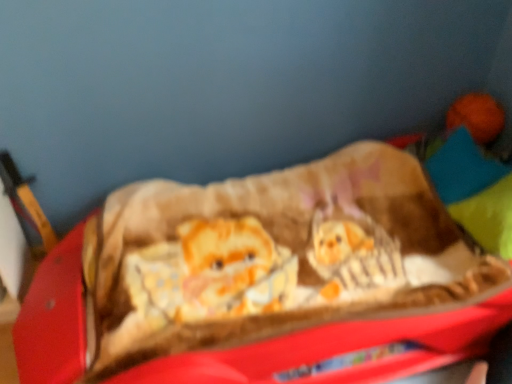
Locate an element on the screen. brown plush dog bed at center is located at coordinates (286, 359).

This screenshot has width=512, height=384. Describe the element at coordinates (286, 359) in the screenshot. I see `brown plush dog bed at center` at that location.

Locate an element on the screen. brown plush dog bed at center is located at coordinates (286, 359).